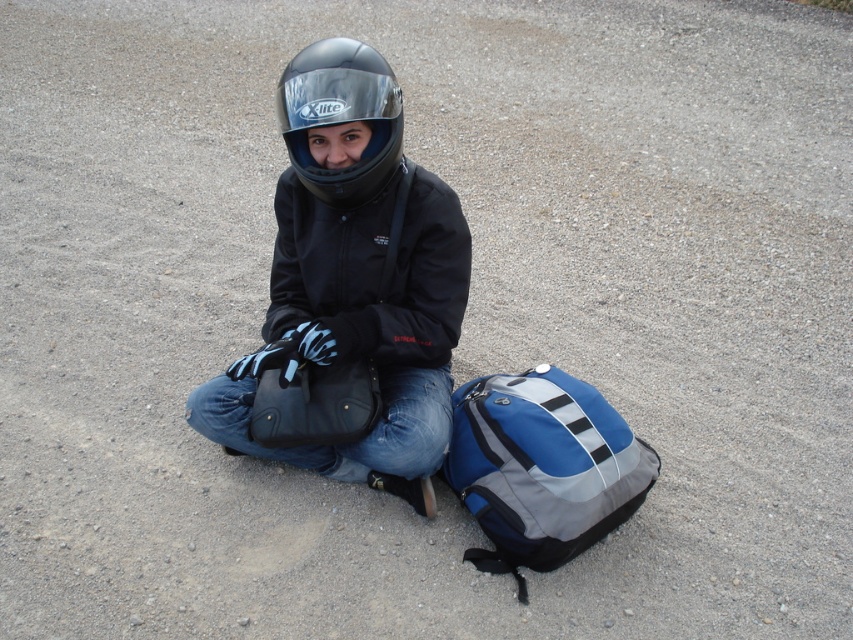
You are a photographer trying to capture the scene with two helmets. You notice the black matte helmet at center and the matte black helmet at center. Which helmet is positioned to the left?

The black matte helmet at center is positioned to the left of the matte black helmet at center.

You are standing at the origin point of the image. There is a point at coordinates (543, 467). Which object is located at that point?

The point at coordinates (543, 467) corresponds to the blue fabric backpack at lower right.